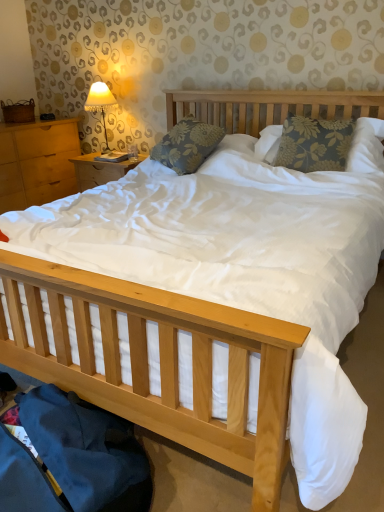
Question: Considering the relative positions of matte fabric lampshade at upper left and floral fabric pillow at center, which is the first pillow from right to left, in the image provided, is matte fabric lampshade at upper left behind floral fabric pillow at center, which is the first pillow from right to left,?

Choices:
 (A) no
 (B) yes

Answer: (B)

Question: Can you confirm if matte fabric lampshade at upper left is wider than floral fabric pillow at center, which is the first pillow from right to left?

Choices:
 (A) no
 (B) yes

Answer: (A)

Question: Can you confirm if matte fabric lampshade at upper left is taller than floral fabric pillow at center, which is the first pillow from right to left?

Choices:
 (A) yes
 (B) no

Answer: (A)

Question: Is matte fabric lampshade at upper left positioned far away from floral fabric pillow at center, placed as the second pillow when sorted from left to right?

Choices:
 (A) no
 (B) yes

Answer: (B)

Question: Is matte fabric lampshade at upper left closer to camera compared to floral fabric pillow at center, placed as the second pillow when sorted from left to right?

Choices:
 (A) yes
 (B) no

Answer: (B)

Question: Considering the relative sizes of matte fabric lampshade at upper left and floral fabric pillow at center, placed as the second pillow when sorted from left to right, in the image provided, is matte fabric lampshade at upper left smaller than floral fabric pillow at center, placed as the second pillow when sorted from left to right,?

Choices:
 (A) yes
 (B) no

Answer: (A)

Question: From a real-world perspective, is light brown wood at left beneath floral fabric pillow at center, the second pillow from the right?

Choices:
 (A) yes
 (B) no

Answer: (A)

Question: Considering the relative sizes of light brown wood at left and floral fabric pillow at center, the second pillow from the right, in the image provided, is light brown wood at left bigger than floral fabric pillow at center, the second pillow from the right,?

Choices:
 (A) yes
 (B) no

Answer: (A)

Question: Can you confirm if light brown wood at left is positioned to the right of floral fabric pillow at center, which ranks as the 1th pillow in left-to-right order?

Choices:
 (A) no
 (B) yes

Answer: (A)

Question: Is floral fabric pillow at center, which ranks as the 1th pillow in left-to-right order, located within light brown wood at left?

Choices:
 (A) yes
 (B) no

Answer: (B)

Question: Does light brown wood at left lie in front of floral fabric pillow at center, which ranks as the 1th pillow in left-to-right order?

Choices:
 (A) yes
 (B) no

Answer: (B)

Question: Is light brown wood at left oriented away from floral fabric pillow at center, which ranks as the 1th pillow in left-to-right order?

Choices:
 (A) no
 (B) yes

Answer: (A)

Question: Is floral fabric pillow at center, which is the first pillow from right to left, beside matte fabric lampshade at upper left?

Choices:
 (A) yes
 (B) no

Answer: (B)